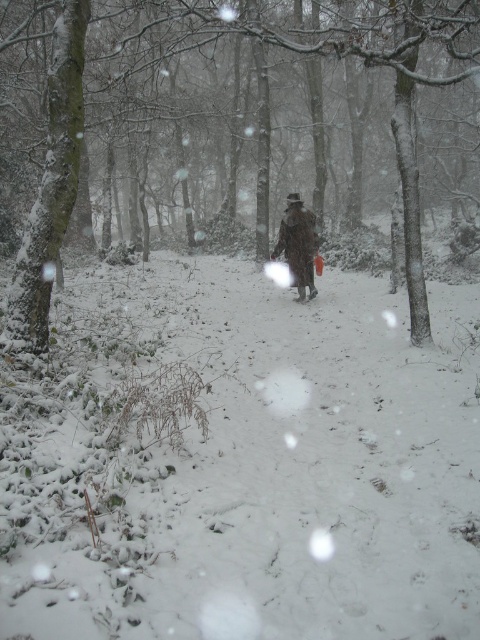
You are a hiker who needs to place a 5 meter long tent between the white fluffy snow at center and the brown wool coat at center. Can you fit the tent between them?

The distance between the white fluffy snow at center and the brown wool coat at center is 4.77 meters. Since the tent is 5 meters long, it cannot be placed between them as the available space is shorter than the tent.

The scene shows a person walking away on a snowy path with a small orange object in their hand. There is also a point marked at coordinates (243,464). What is located at that point?

The point at coordinates (243,464) marks white fluffy snow at center.